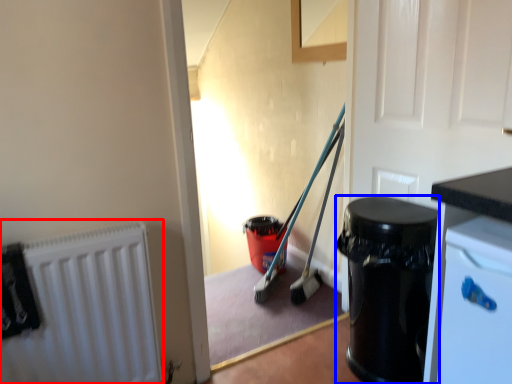
Question: Which point is further to the camera, radiator (highlighted by a red box) or garbage (highlighted by a blue box)?

Choices:
 (A) radiator
 (B) garbage

Answer: (B)